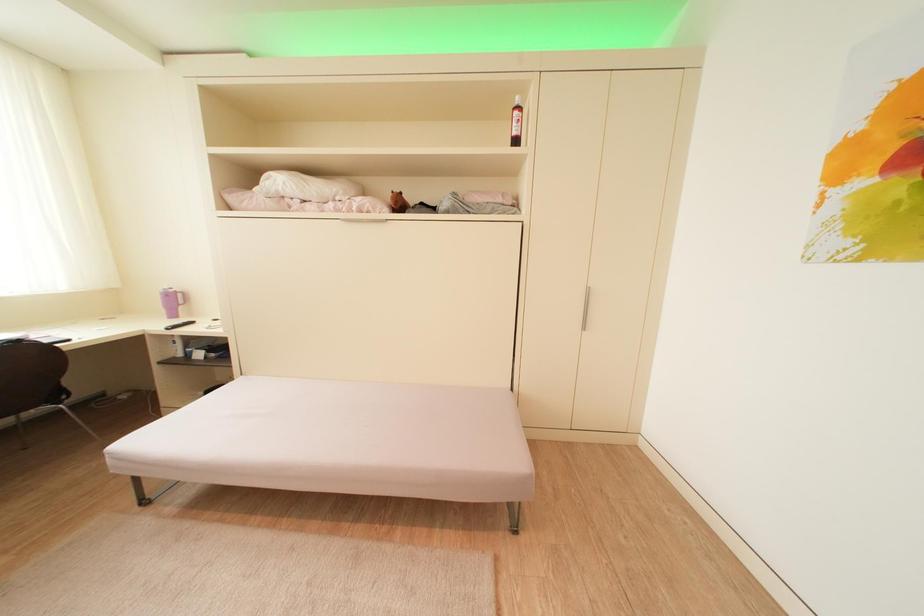
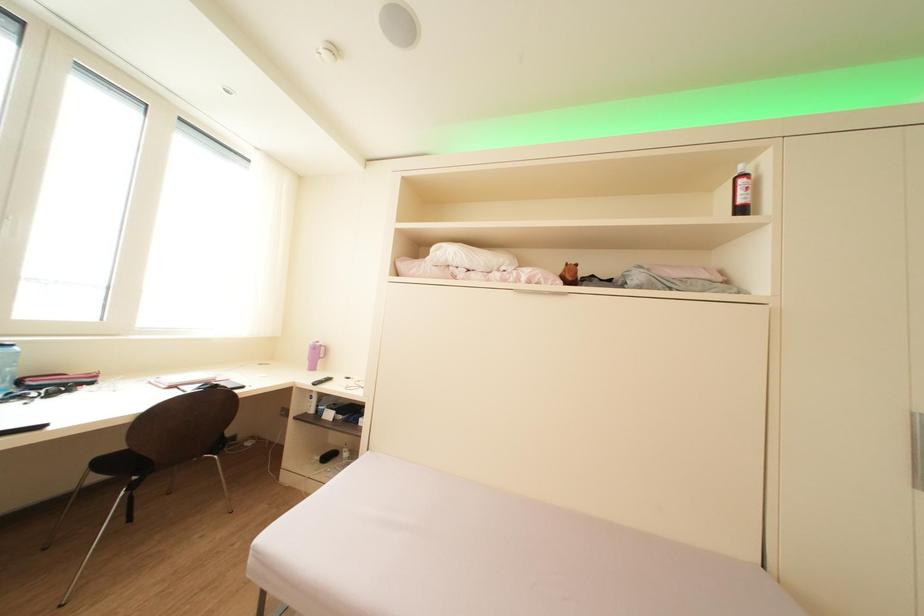
Question: Based on the continuous images, in which direction is the camera rotating? Reply with the corresponding letter.

Choices:
 (A) Left
 (B) Right
 (C) Up
 (D) Down

Answer: (C)